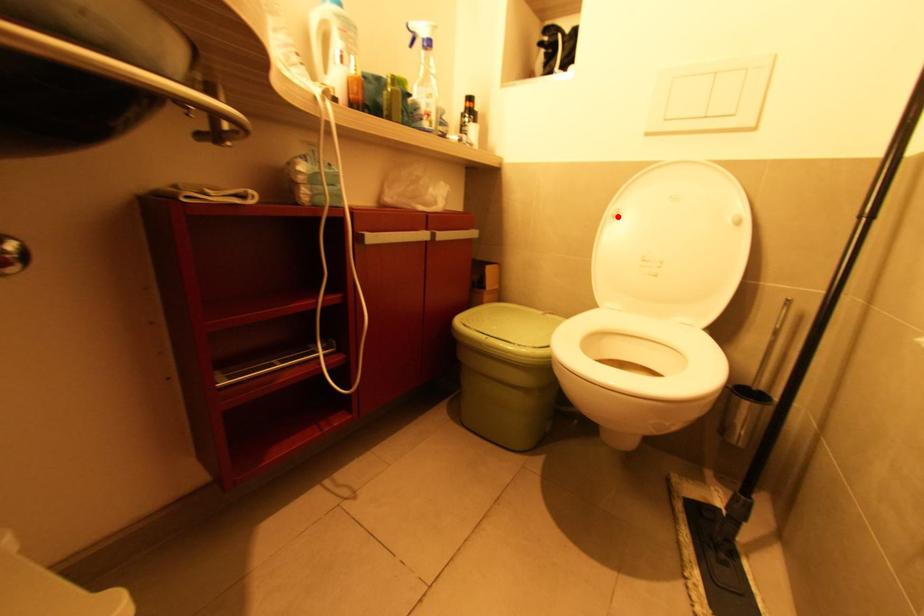
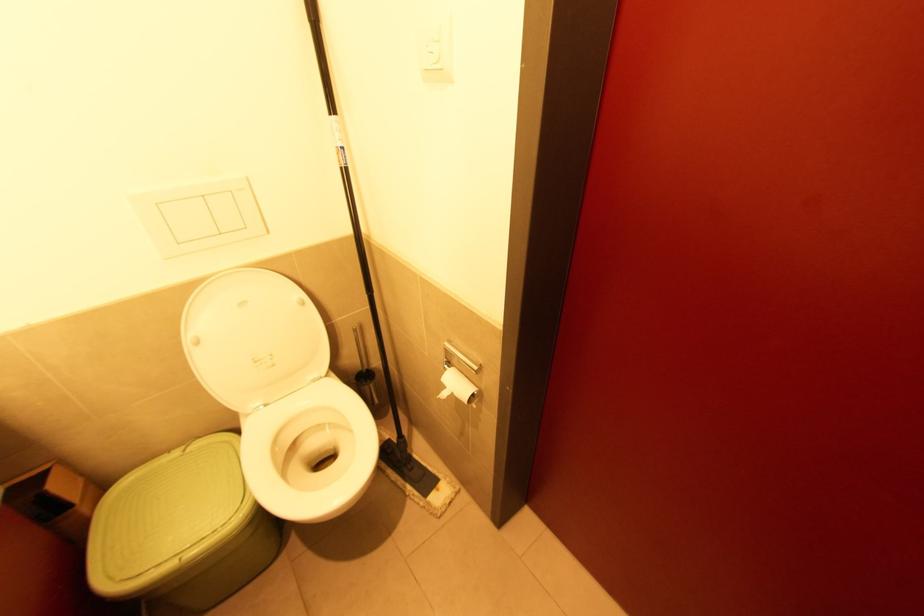
Find the pixel in the second image that matches the highlighted location in the first image.

(200, 342)